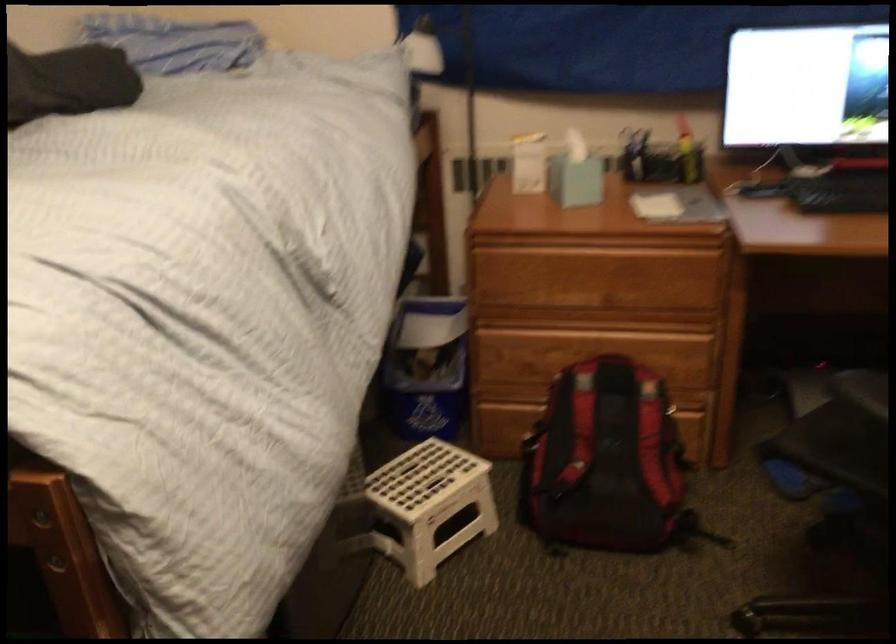
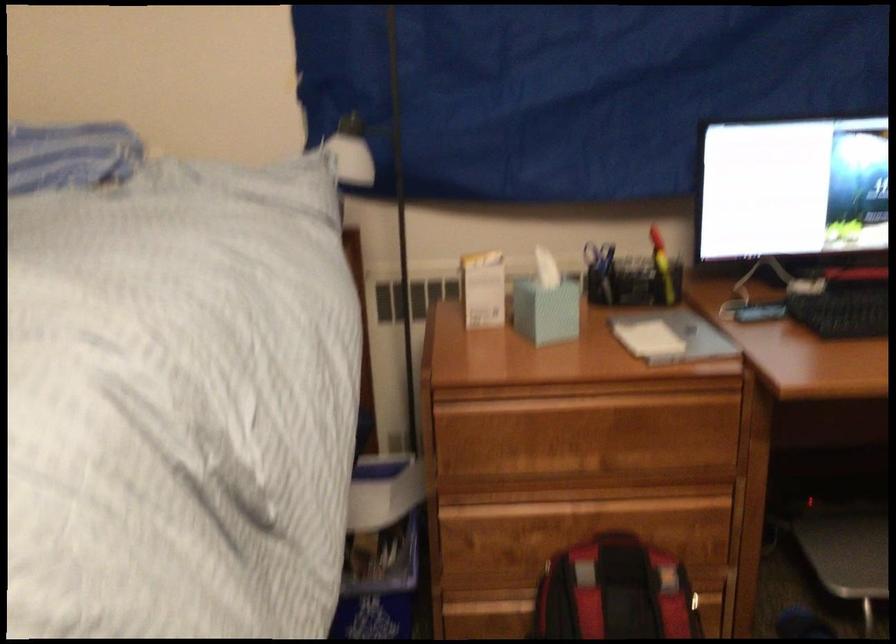
Find the pixel in the second image that matches pixel 507 406 in the first image.

(478, 601)